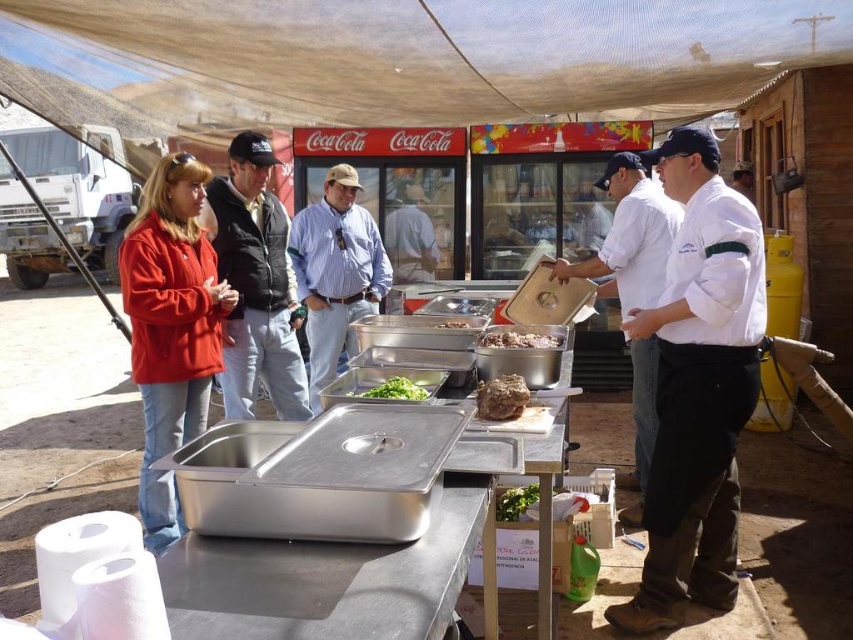
Question: Which object is farther from the camera taking this photo?

Choices:
 (A) green leafy vegetables at center
 (B) white matte chef coat at center
 (C) shiny silver tray at center
 (D) white chef coat at center

Answer: (D)

Question: Is brushed metal food truck at left smaller than brown matte meat at center?

Choices:
 (A) no
 (B) yes

Answer: (A)

Question: Which point is closer to the camera?

Choices:
 (A) blue striped shirt at center
 (B) fleece jacket at left
 (C) white chef coat at center
 (D) brushed metal food truck at left

Answer: (B)

Question: Is white chef coat at center further to the viewer compared to shiny silver tray at center?

Choices:
 (A) yes
 (B) no

Answer: (A)

Question: Considering the real-world distances, which object is closest to the brown matte meat at center?

Choices:
 (A) brushed metal food truck at left
 (B) blue striped shirt at center
 (C) white matte chef coat at center

Answer: (C)

Question: Does blue striped shirt at center appear under white chef coat at center?

Choices:
 (A) yes
 (B) no

Answer: (B)